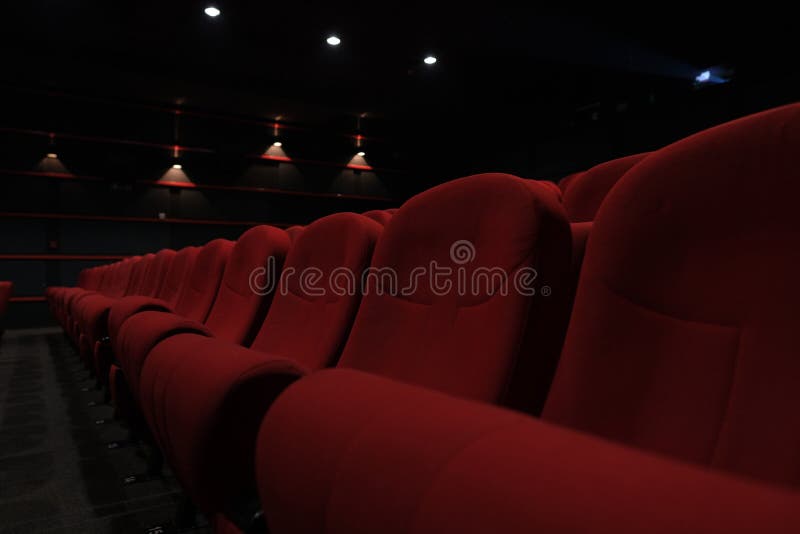
Where is `front rounded part of seat`? The image size is (800, 534). front rounded part of seat is located at coordinates (338, 460), (206, 374), (152, 327), (129, 310), (93, 309), (78, 296), (60, 296), (48, 294).